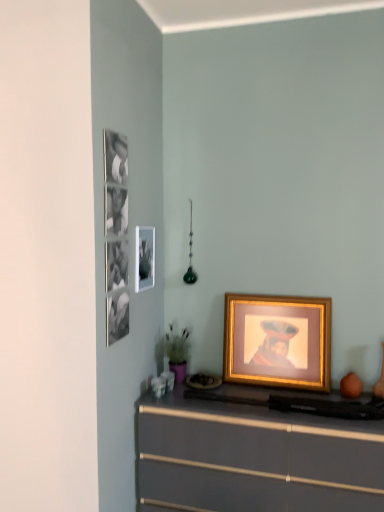
Measure the distance between point (232, 509) and camera.

Point (232, 509) and camera are 6.25 feet apart.

Image resolution: width=384 pixels, height=512 pixels. Identify the location of matte gray chest of drawers at lower center. (254, 458).

Is matte gray chest of drawers at lower center taller than gold metallic picture frame at center, the 1th picture frame positioned from the bottom?

Indeed, matte gray chest of drawers at lower center has a greater height compared to gold metallic picture frame at center, the 1th picture frame positioned from the bottom.

Which point is more distant from viewer, [143,493] or [245,329]?

Positioned behind is point [245,329].

From the image's perspective, does matte gray chest of drawers at lower center appear higher than gold metallic picture frame at center, the 1th picture frame positioned from the bottom?

Actually, matte gray chest of drawers at lower center appears below gold metallic picture frame at center, the 1th picture frame positioned from the bottom, in the image.

Is there a large distance between matte gray chest of drawers at lower center and gold metallic picture frame at center, the first picture frame when ordered from right to left?

That's not correct — matte gray chest of drawers at lower center is a little close to gold metallic picture frame at center, the first picture frame when ordered from right to left.

Is point (137, 281) positioned behind point (238, 353)?

No, (137, 281) is in front of (238, 353).

Is metallic silver picture frame at upper left, arranged as the first picture frame when viewed from the top, positioned far away from gold metallic picture frame at center, the 1th picture frame positioned from the bottom?

Actually, metallic silver picture frame at upper left, arranged as the first picture frame when viewed from the top, and gold metallic picture frame at center, the 1th picture frame positioned from the bottom, are a little close together.

Locate an element on the screen. The height and width of the screenshot is (512, 384). picture frame in front of the gold metallic picture frame at center, the 1th picture frame positioned from the bottom is located at coordinates (145, 258).

Does metallic silver picture frame at upper left, acting as the first picture frame starting from the left, have a smaller size compared to gold metallic picture frame at center, placed as the second picture frame when sorted from left to right?

Yes.

How many degrees apart are the facing directions of matte gray chest of drawers at lower center and metallic silver picture frame at upper left, the second picture frame from the bottom?

There is a 88.3-degree angle between the facing directions of matte gray chest of drawers at lower center and metallic silver picture frame at upper left, the second picture frame from the bottom.

Which is behind, point (193, 426) or point (140, 233)?

The point (140, 233) is behind.

The width and height of the screenshot is (384, 512). Identify the location of chest of drawers on the right of metallic silver picture frame at upper left, arranged as the second picture frame when viewed from the right. point(254,458).

Could you tell me if matte gray chest of drawers at lower center is facing metallic silver picture frame at upper left, arranged as the second picture frame when viewed from the right?

No, matte gray chest of drawers at lower center does not turn towards metallic silver picture frame at upper left, arranged as the second picture frame when viewed from the right.

Considering the points (281, 373) and (205, 495), which point is in front, point (281, 373) or point (205, 495)?

The point (205, 495) is in front.

Which is more to the left, gold metallic picture frame at center, the 1th picture frame positioned from the bottom, or matte gray chest of drawers at lower center?

matte gray chest of drawers at lower center is more to the left.

Which of these two, gold metallic picture frame at center, which is counted as the second picture frame, starting from the top, or matte gray chest of drawers at lower center, is smaller?

Smaller between the two is gold metallic picture frame at center, which is counted as the second picture frame, starting from the top.

Does metallic silver picture frame at upper left, acting as the first picture frame starting from the left, have a greater width compared to matte gray chest of drawers at lower center?

No.

Does metallic silver picture frame at upper left, arranged as the second picture frame when viewed from the right, turn towards matte gray chest of drawers at lower center?

No, metallic silver picture frame at upper left, arranged as the second picture frame when viewed from the right, is not turned towards matte gray chest of drawers at lower center.

Are metallic silver picture frame at upper left, the second picture frame from the bottom, and matte gray chest of drawers at lower center making contact?

No, metallic silver picture frame at upper left, the second picture frame from the bottom, is not next to matte gray chest of drawers at lower center.

Which of these two, metallic silver picture frame at upper left, arranged as the first picture frame when viewed from the top, or matte gray chest of drawers at lower center, is bigger?

With larger size is matte gray chest of drawers at lower center.

Looking at this image, how different are the orientations of gold metallic picture frame at center, which is counted as the second picture frame, starting from the top, and metallic silver picture frame at upper left, the second picture frame from the bottom, in degrees?

The angle between the facing direction of gold metallic picture frame at center, which is counted as the second picture frame, starting from the top, and the facing direction of metallic silver picture frame at upper left, the second picture frame from the bottom, is 88.4 degrees.

Locate an element on the screen. This screenshot has width=384, height=512. picture frame below the metallic silver picture frame at upper left, arranged as the second picture frame when viewed from the right (from a real-world perspective) is located at coordinates (278, 341).

From the image's perspective, is gold metallic picture frame at center, the first picture frame when ordered from right to left, on metallic silver picture frame at upper left, arranged as the first picture frame when viewed from the top?

Actually, gold metallic picture frame at center, the first picture frame when ordered from right to left, appears below metallic silver picture frame at upper left, arranged as the first picture frame when viewed from the top, in the image.

In terms of height, does gold metallic picture frame at center, the first picture frame when ordered from right to left, look taller or shorter compared to metallic silver picture frame at upper left, arranged as the first picture frame when viewed from the top?

Considering their sizes, gold metallic picture frame at center, the first picture frame when ordered from right to left, has more height than metallic silver picture frame at upper left, arranged as the first picture frame when viewed from the top.

Where is `the 1st picture frame located above the matte gray chest of drawers at lower center (from a real-world perspective)`? the 1st picture frame located above the matte gray chest of drawers at lower center (from a real-world perspective) is located at coordinates (278, 341).

Find the location of a particular element. picture frame below the metallic silver picture frame at upper left, arranged as the first picture frame when viewed from the top (from a real-world perspective) is located at coordinates (278, 341).

Looking at the image, which one is located closer to matte gray chest of drawers at lower center, gold metallic picture frame at center, the 1th picture frame positioned from the bottom, or metallic silver picture frame at upper left, arranged as the first picture frame when viewed from the top?

Based on the image, gold metallic picture frame at center, the 1th picture frame positioned from the bottom, appears to be nearer to matte gray chest of drawers at lower center.

When comparing their distances from matte gray chest of drawers at lower center, does metallic silver picture frame at upper left, acting as the first picture frame starting from the left, or gold metallic picture frame at center, placed as the second picture frame when sorted from left to right, seem further?

metallic silver picture frame at upper left, acting as the first picture frame starting from the left, lies further to matte gray chest of drawers at lower center than the other object.

From the image, which object appears to be farther from gold metallic picture frame at center, which is counted as the second picture frame, starting from the top, matte gray chest of drawers at lower center or metallic silver picture frame at upper left, arranged as the second picture frame when viewed from the right?

Among the two, metallic silver picture frame at upper left, arranged as the second picture frame when viewed from the right, is located further to gold metallic picture frame at center, which is counted as the second picture frame, starting from the top.

When comparing their distances from metallic silver picture frame at upper left, acting as the first picture frame starting from the left, does matte gray chest of drawers at lower center or gold metallic picture frame at center, which is counted as the second picture frame, starting from the top, seem further?

matte gray chest of drawers at lower center lies further to metallic silver picture frame at upper left, acting as the first picture frame starting from the left, than the other object.

Estimate the real-world distances between objects in this image. Which object is further from gold metallic picture frame at center, placed as the second picture frame when sorted from left to right, metallic silver picture frame at upper left, arranged as the first picture frame when viewed from the top, or matte gray chest of drawers at lower center?

Among the two, metallic silver picture frame at upper left, arranged as the first picture frame when viewed from the top, is located further to gold metallic picture frame at center, placed as the second picture frame when sorted from left to right.

Looking at the image, which one is located further to metallic silver picture frame at upper left, arranged as the second picture frame when viewed from the right, gold metallic picture frame at center, the first picture frame when ordered from right to left, or matte gray chest of drawers at lower center?

Based on the image, matte gray chest of drawers at lower center appears to be further to metallic silver picture frame at upper left, arranged as the second picture frame when viewed from the right.

This screenshot has height=512, width=384. In order to click on picture frame that lies between metallic silver picture frame at upper left, acting as the first picture frame starting from the left, and matte gray chest of drawers at lower center from top to bottom in this screenshot , I will do `click(278, 341)`.